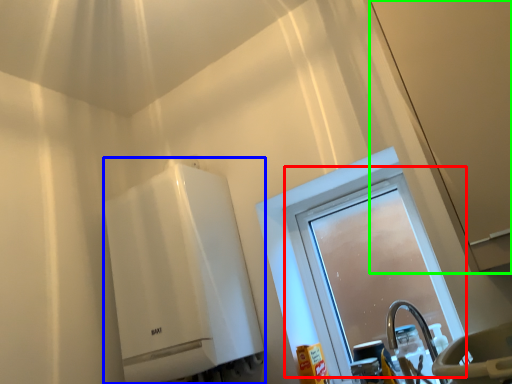
Question: Which object is positioned closest to window (highlighted by a red box)? Select from water heater (highlighted by a blue box) and screen door (highlighted by a green box).

Choices:
 (A) water heater
 (B) screen door

Answer: (A)